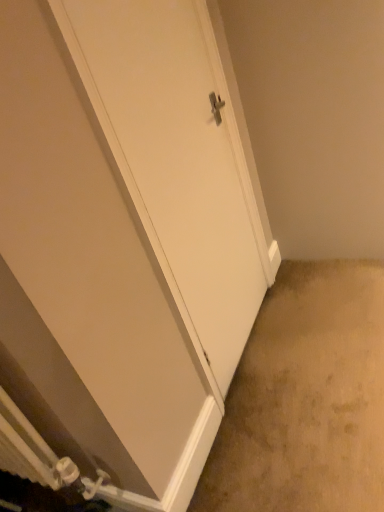
Question: From a real-world perspective, is beige carpet at lower right physically above white matte door at center?

Choices:
 (A) no
 (B) yes

Answer: (A)

Question: Is white matte door at center located within beige carpet at lower right?

Choices:
 (A) no
 (B) yes

Answer: (A)

Question: From the image's perspective, is beige carpet at lower right under white matte door at center?

Choices:
 (A) no
 (B) yes

Answer: (B)

Question: Is the position of beige carpet at lower right more distant than that of white matte door at center?

Choices:
 (A) yes
 (B) no

Answer: (A)

Question: Considering the relative sizes of beige carpet at lower right and white matte door at center in the image provided, is beige carpet at lower right wider than white matte door at center?

Choices:
 (A) no
 (B) yes

Answer: (B)

Question: Does beige carpet at lower right come in front of white matte door at center?

Choices:
 (A) no
 (B) yes

Answer: (A)

Question: From a real-world perspective, does white matte door at center sit lower than beige carpet at lower right?

Choices:
 (A) no
 (B) yes

Answer: (A)

Question: Is the position of white matte door at center less distant than that of beige carpet at lower right?

Choices:
 (A) yes
 (B) no

Answer: (A)

Question: Would you say white matte door at center is a long distance from beige carpet at lower right?

Choices:
 (A) no
 (B) yes

Answer: (A)

Question: Does white matte door at center have a greater height compared to beige carpet at lower right?

Choices:
 (A) yes
 (B) no

Answer: (A)

Question: From a real-world perspective, is white matte door at center on top of beige carpet at lower right?

Choices:
 (A) yes
 (B) no

Answer: (A)

Question: Considering the relative positions of white matte door at center and beige carpet at lower right in the image provided, is white matte door at center to the right of beige carpet at lower right from the viewer's perspective?

Choices:
 (A) no
 (B) yes

Answer: (A)

Question: Is beige carpet at lower right wider or thinner than white matte door at center?

Choices:
 (A) thin
 (B) wide

Answer: (B)